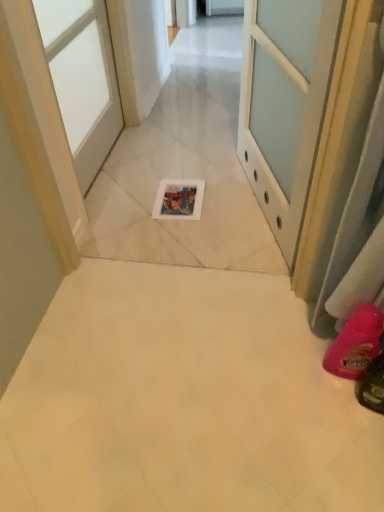
Question: Does pink rubber boot at lower right have a lesser height compared to white glossy door at upper left, the second door from the right?

Choices:
 (A) yes
 (B) no

Answer: (A)

Question: Is pink rubber boot at lower right to the left of white glossy door at upper left, acting as the 1th door starting from the left, from the viewer's perspective?

Choices:
 (A) yes
 (B) no

Answer: (B)

Question: From a real-world perspective, is pink rubber boot at lower right under white glossy door at upper left, the second door from the right?

Choices:
 (A) no
 (B) yes

Answer: (B)

Question: Is pink rubber boot at lower right positioned beyond the bounds of white glossy door at upper left, the second door from the right?

Choices:
 (A) yes
 (B) no

Answer: (A)

Question: Is pink rubber boot at lower right behind white glossy door at upper left, acting as the 1th door starting from the left?

Choices:
 (A) no
 (B) yes

Answer: (A)

Question: Looking at the image, does pink rubber boot at lower right seem bigger or smaller compared to white glossy door at upper left, acting as the 1th door starting from the left?

Choices:
 (A) small
 (B) big

Answer: (A)

Question: Is pink rubber boot at lower right taller or shorter than white glossy door at upper left, the second door from the right?

Choices:
 (A) tall
 (B) short

Answer: (B)

Question: Considering the positions of pink rubber boot at lower right and white glossy door at upper left, acting as the 1th door starting from the left, in the image, is pink rubber boot at lower right wider or thinner than white glossy door at upper left, acting as the 1th door starting from the left,?

Choices:
 (A) wide
 (B) thin

Answer: (A)

Question: From the image's perspective, relative to white glossy door at upper left, the second door from the right, is pink rubber boot at lower right above or below?

Choices:
 (A) below
 (B) above

Answer: (A)

Question: From a real-world perspective, is white glossy door at upper center, placed as the first door when sorted from right to left, positioned above or below pink rubber boot at lower right?

Choices:
 (A) below
 (B) above

Answer: (B)

Question: Relative to pink rubber boot at lower right, is white glossy door at upper center, placed as the first door when sorted from right to left, in front or behind?

Choices:
 (A) front
 (B) behind

Answer: (A)

Question: Is white glossy door at upper center, which appears as the 2th door when viewed from the left, wider or thinner than pink rubber boot at lower right?

Choices:
 (A) wide
 (B) thin

Answer: (B)

Question: Considering the positions of point (269, 138) and point (347, 350), is point (269, 138) closer or farther from the camera than point (347, 350)?

Choices:
 (A) closer
 (B) farther

Answer: (B)

Question: From a real-world perspective, is pink rubber boot at lower right physically located above or below white glossy door at upper center, placed as the first door when sorted from right to left?

Choices:
 (A) below
 (B) above

Answer: (A)

Question: In terms of height, does pink rubber boot at lower right look taller or shorter compared to white glossy door at upper center, which appears as the 2th door when viewed from the left?

Choices:
 (A) tall
 (B) short

Answer: (B)